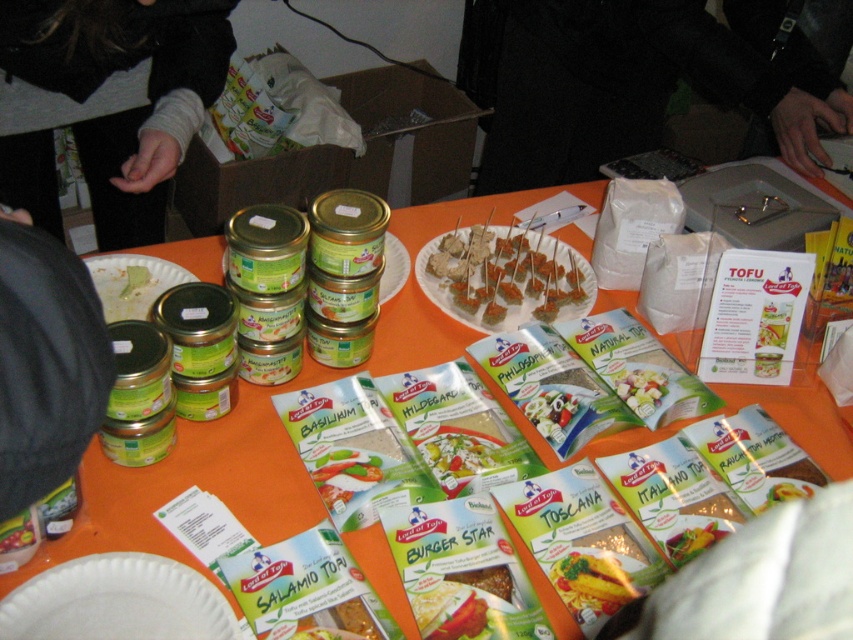
From the picture: Can you confirm if black fabric at left is thinner than white paper plate at center?

In fact, black fabric at left might be wider than white paper plate at center.

I want to click on black fabric at left, so click(45, 364).

Identify the location of black fabric at left. (45, 364).

Is white paper plate at upper left taller than yellow matte pasta at center?

Yes.

Can you confirm if white paper plate at upper left is wider than yellow matte pasta at center?

Indeed, white paper plate at upper left has a greater width compared to yellow matte pasta at center.

The image size is (853, 640). Describe the element at coordinates (132, 282) in the screenshot. I see `white paper plate at upper left` at that location.

The width and height of the screenshot is (853, 640). What are the coordinates of `white paper plate at upper left` in the screenshot? It's located at (132, 282).

Is black fabric at upper center wider than white paper plate at lower left?

Indeed, black fabric at upper center has a greater width compared to white paper plate at lower left.

Which is behind, point (813, 58) or point (155, 588)?

The point (813, 58) is behind.

Locate an element on the screen. This screenshot has height=640, width=853. black fabric at upper center is located at coordinates (641, 83).